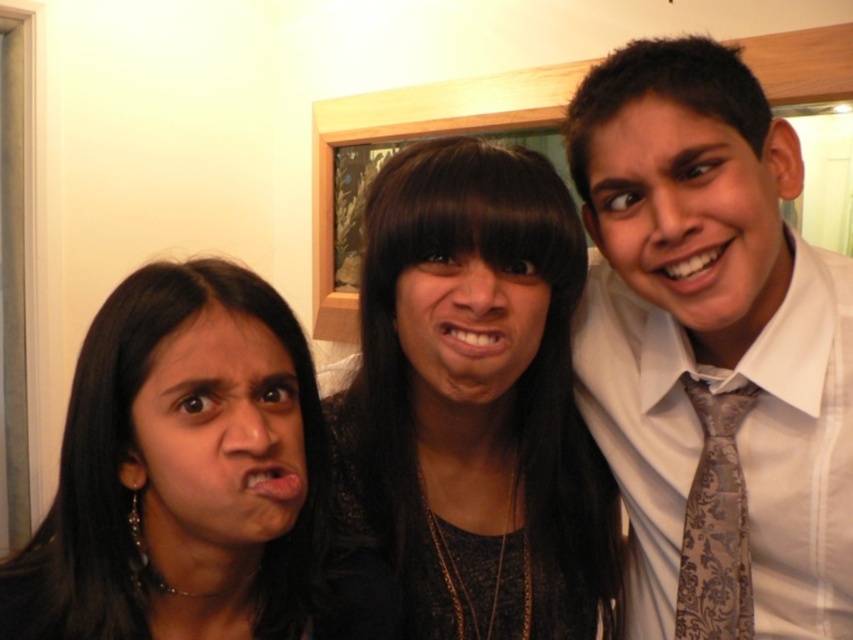
Question: Does white silk shirt at right appear under dark brown hair at center?

Choices:
 (A) yes
 (B) no

Answer: (B)

Question: Can you confirm if black lace dress at center is positioned to the left of silvery-patterned tie at right?

Choices:
 (A) no
 (B) yes

Answer: (B)

Question: Does white silk shirt at right have a lesser width compared to black lace dress at center?

Choices:
 (A) yes
 (B) no

Answer: (A)

Question: Which is farther from the black lace dress at center?

Choices:
 (A) white silk shirt at right
 (B) silvery-patterned tie at right
 (C) dark brown hair at center

Answer: (B)

Question: Which point is farther to the camera?

Choices:
 (A) (129, 384)
 (B) (688, 545)
 (C) (775, 365)
 (D) (469, 237)

Answer: (B)

Question: Among these points, which one is nearest to the camera?

Choices:
 (A) (643, 412)
 (B) (723, 588)

Answer: (B)